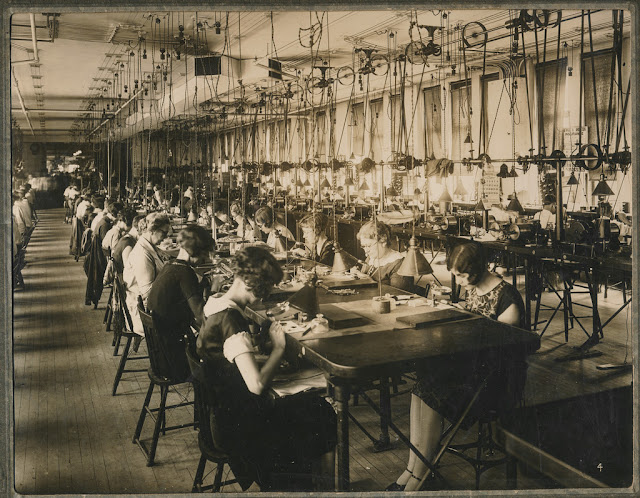
At what (x,y) coordinates should I click in order to perform the action: click on old photograph. Please return your answer as a coordinate pair (x, y). Looking at the image, I should click on (100, 465).